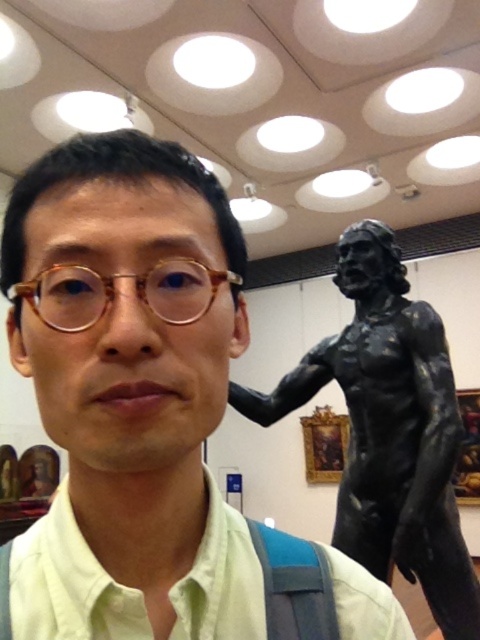
Question: Does matte black statue at right have a greater width compared to light green cotton shirt at center?

Choices:
 (A) yes
 (B) no

Answer: (B)

Question: Does black bronze statue at right have a lesser width compared to light green cotton shirt at center?

Choices:
 (A) no
 (B) yes

Answer: (A)

Question: Can you confirm if tortoiseshell frame glasses at center is bigger than light green cotton shirt at center?

Choices:
 (A) yes
 (B) no

Answer: (B)

Question: Which object appears closest to the camera in this image?

Choices:
 (A) matte black statue at right
 (B) light green cotton shirt at center
 (C) tortoiseshell frame glasses at center
 (D) black bronze statue at right

Answer: (A)

Question: Which object is farther from the camera taking this photo?

Choices:
 (A) black bronze statue at right
 (B) matte black statue at right
 (C) light green cotton shirt at center

Answer: (A)

Question: Which point is closer to the camera taking this photo?

Choices:
 (A) (94, 596)
 (B) (427, 321)

Answer: (A)